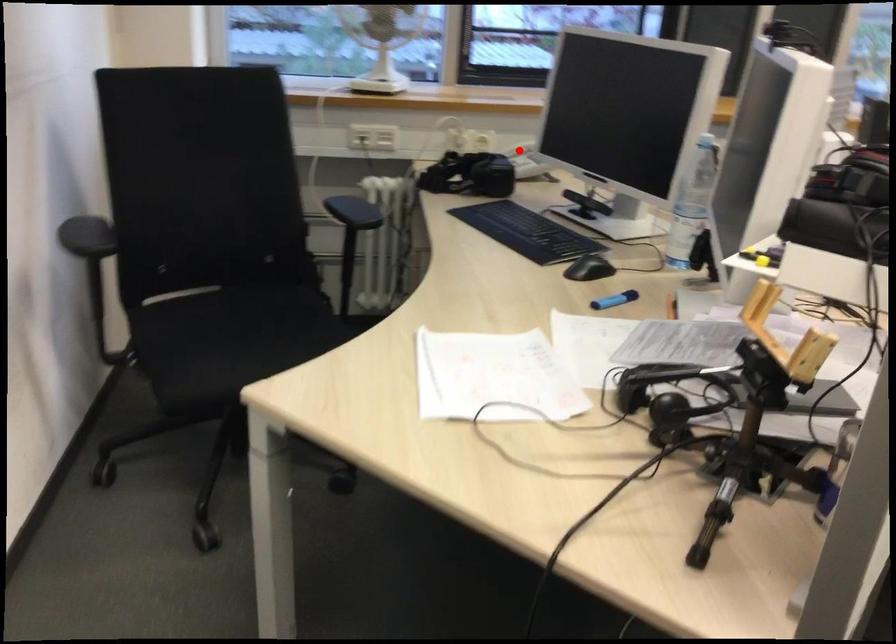
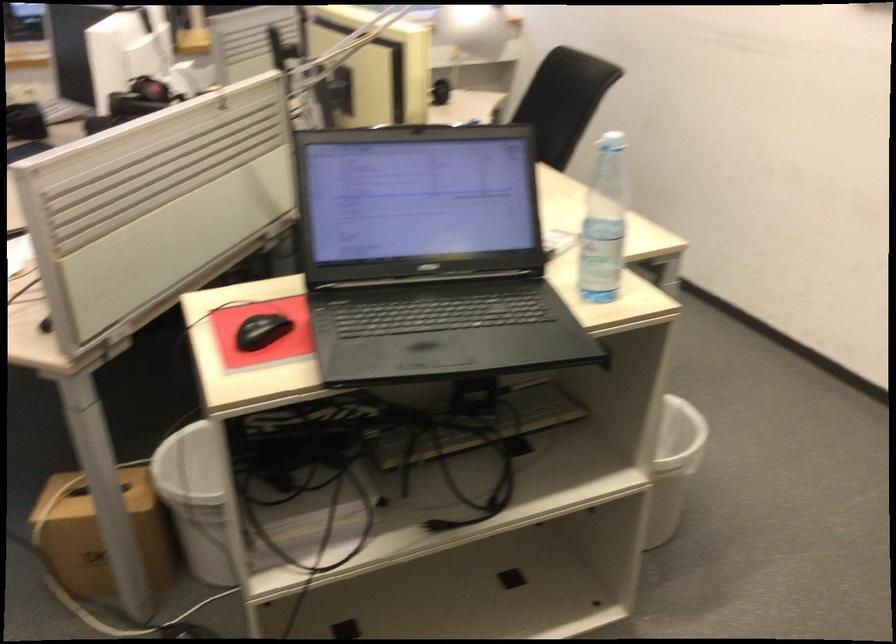
Question: I am providing you with two images of the same scene from different viewpoints. A red point is marked on the first image. Is the red point's position out of view in image 2?

Choices:
 (A) Yes
 (B) No

Answer: (A)